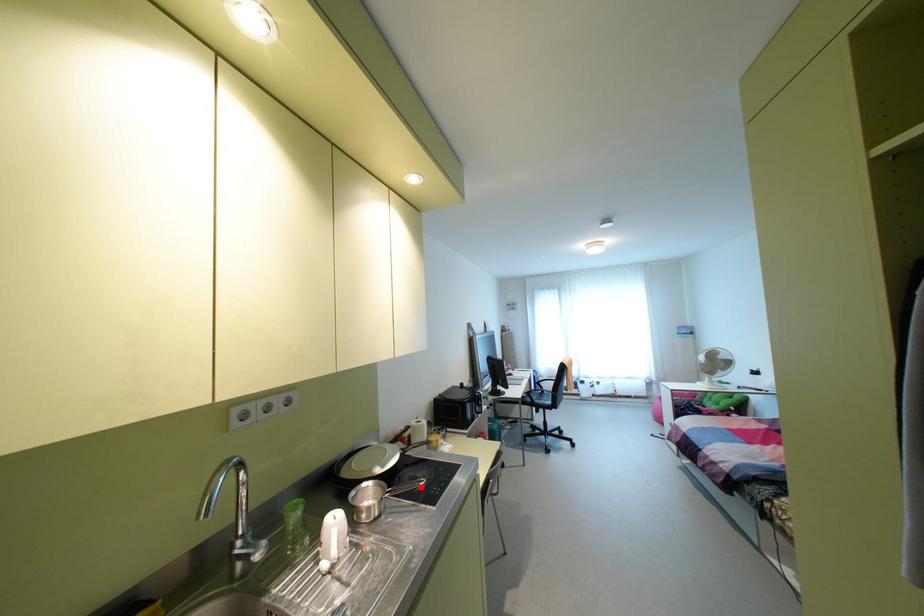
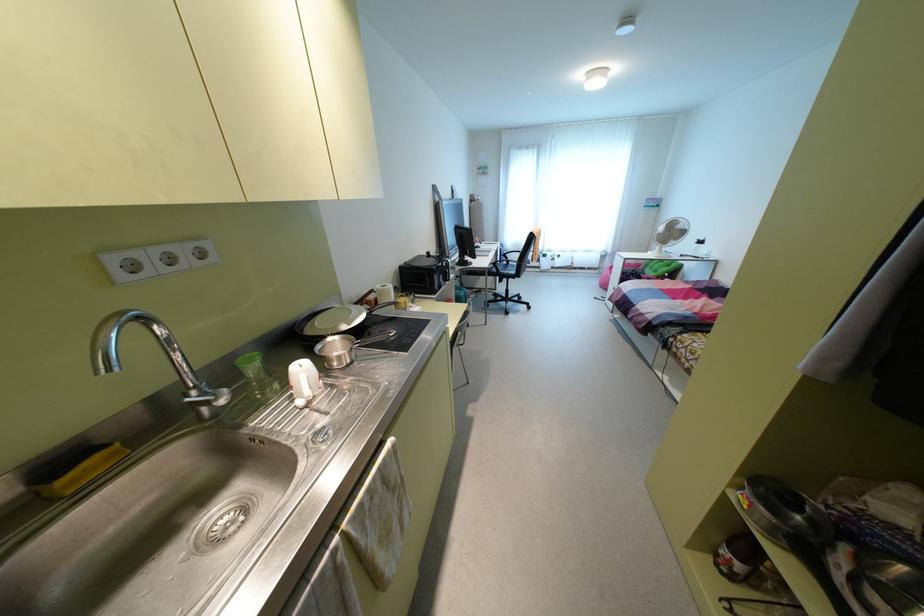
Where in the second image is the point corresponding to the highlighted location from the first image?

(392, 339)